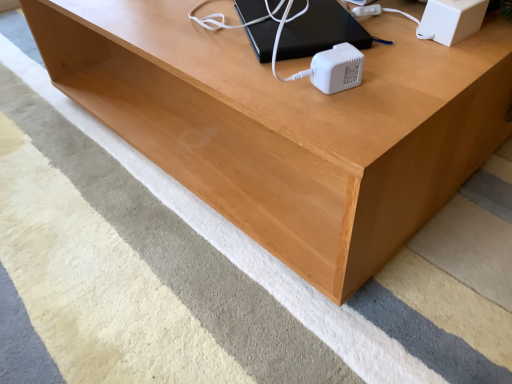
Identify the location of free space in front of white plastic speaker at upper right. (442, 65).